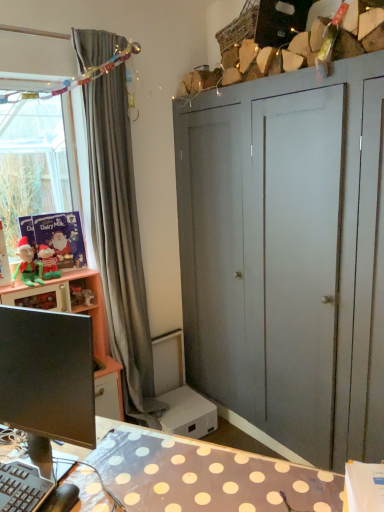
Question: Considering the positions of matte gray wardrobe at upper right and black glossy monitor at lower left in the image, is matte gray wardrobe at upper right bigger or smaller than black glossy monitor at lower left?

Choices:
 (A) small
 (B) big

Answer: (B)

Question: Is matte gray wardrobe at upper right situated inside black glossy monitor at lower left or outside?

Choices:
 (A) outside
 (B) inside

Answer: (A)

Question: Based on their relative distances, which object is farther from the green plush elf at left?

Choices:
 (A) gray fabric curtain at left
 (B) black plastic keyboard at lower left
 (C) black glossy monitor at lower left
 (D) matte gray wardrobe at upper right
 (E) green plush elf at left

Answer: (B)

Question: Which is farther from the black glossy monitor at lower left?

Choices:
 (A) matte gray wardrobe at upper right
 (B) green plush elf at left
 (C) green plush elf at left
 (D) gray fabric curtain at left
 (E) black plastic keyboard at lower left

Answer: (A)